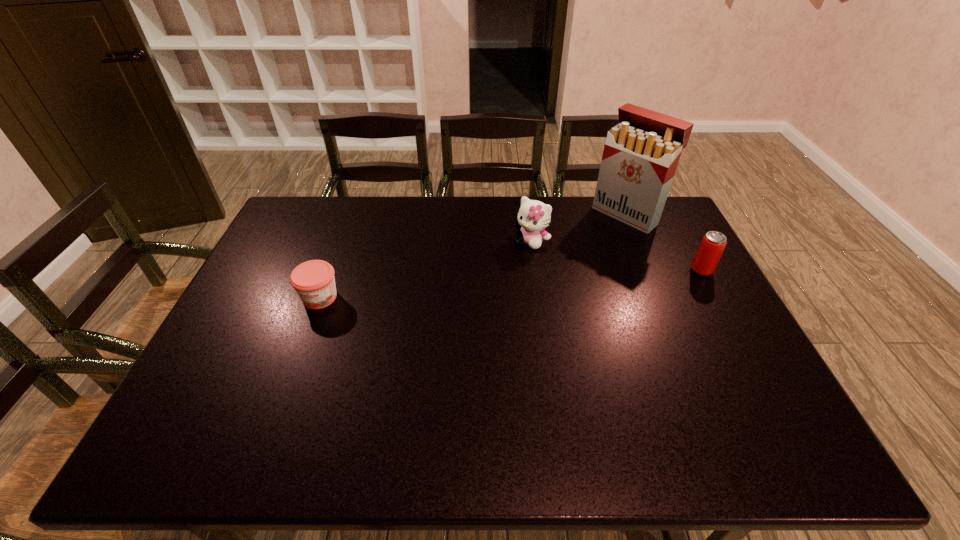
Find the location of a particular element. This screenshot has width=960, height=540. vacant space on the desktop that is between the nearest object and the third farthest object and is positioned on the front-facing side of the kitten is located at coordinates (490, 286).

The width and height of the screenshot is (960, 540). What are the coordinates of `free space on the desktop that is between the jam and the rightmost object and is positioned with the lid open on the third object from left to right` in the screenshot? It's located at (541, 282).